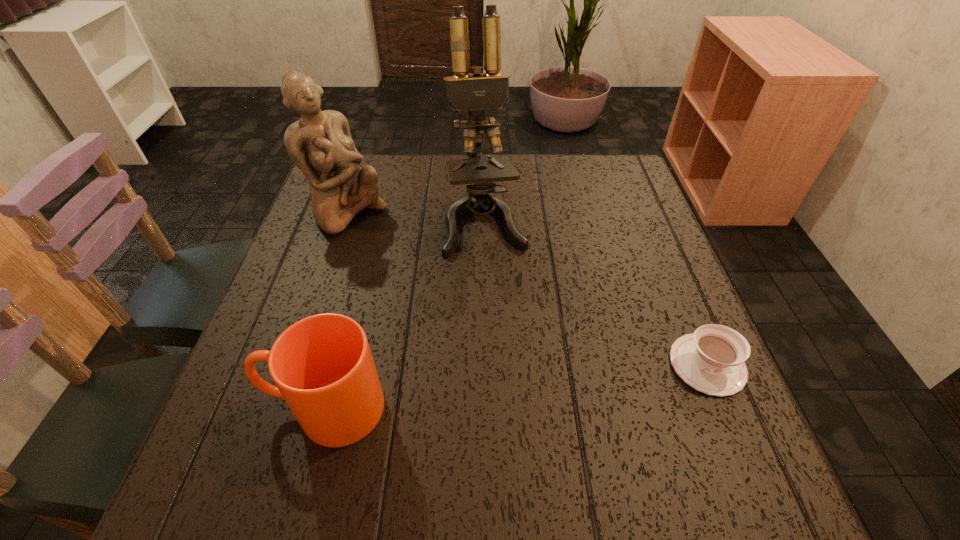
Where is `vacant space located at the eyepieces of the tallest object`? The height and width of the screenshot is (540, 960). vacant space located at the eyepieces of the tallest object is located at coordinates (516, 358).

Where is `blank space located 0.170m at the eyepieces of the tallest object`? The height and width of the screenshot is (540, 960). blank space located 0.170m at the eyepieces of the tallest object is located at coordinates (505, 314).

Locate an element on the screen. figurine present at the far edge is located at coordinates (320, 144).

This screenshot has height=540, width=960. What are the coordinates of `microscope present at the far edge` in the screenshot? It's located at (474, 92).

Locate an element on the screen. mug present at the near edge is located at coordinates (322, 365).

Find the location of a particular element. teacup located at the near edge is located at coordinates (711, 360).

Locate an element on the screen. mug located in the left edge section of the desktop is located at coordinates (322, 365).

Find the location of a particular element. This screenshot has height=540, width=960. figurine located in the left edge section of the desktop is located at coordinates (320, 144).

Where is `object present at the right edge`? object present at the right edge is located at coordinates (711, 360).

Where is `object present at the far left corner`? Image resolution: width=960 pixels, height=540 pixels. object present at the far left corner is located at coordinates (320, 144).